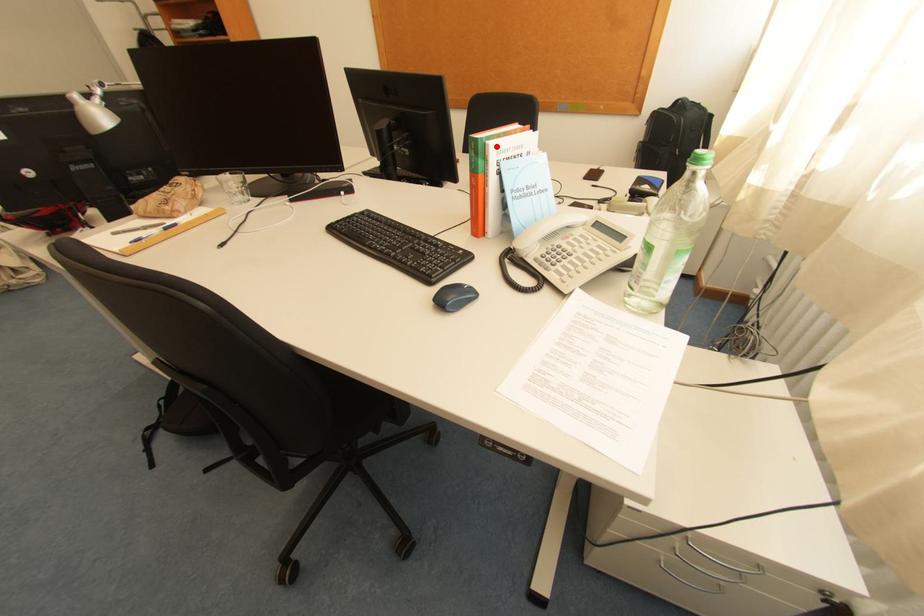
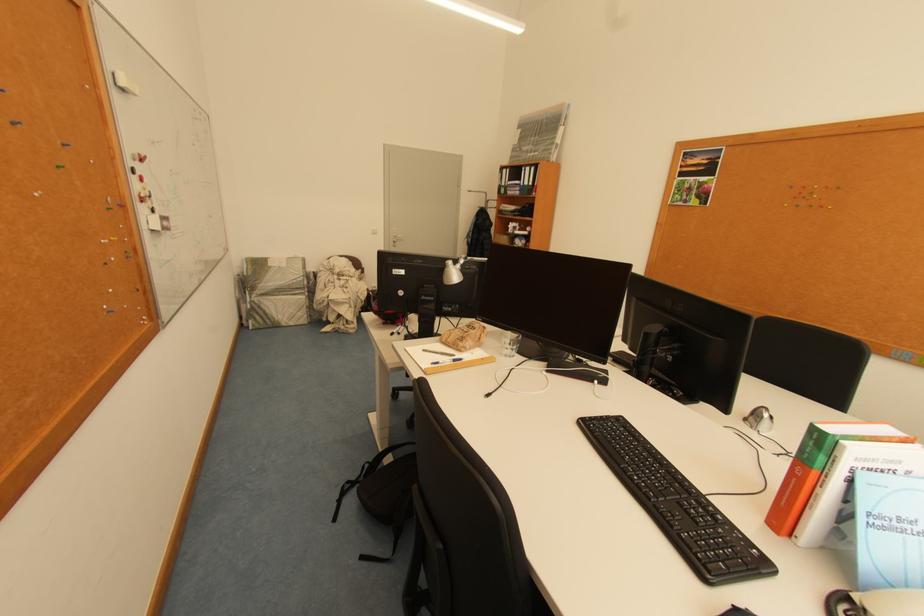
Question: I am providing you with two images of the same scene from different viewpoints. A red point is shown in image1. For the corresponding object point in image2, is it positioned nearer or farther from the camera?

Choices:
 (A) Nearer
 (B) Farther

Answer: (A)